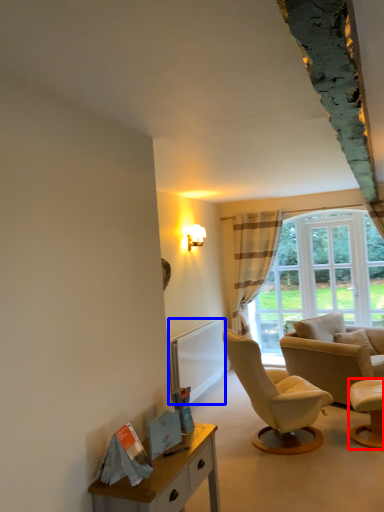
Question: Which of the following is the farthest to the observer, chair (highlighted by a red box) or radiator (highlighted by a blue box)?

Choices:
 (A) chair
 (B) radiator

Answer: (B)